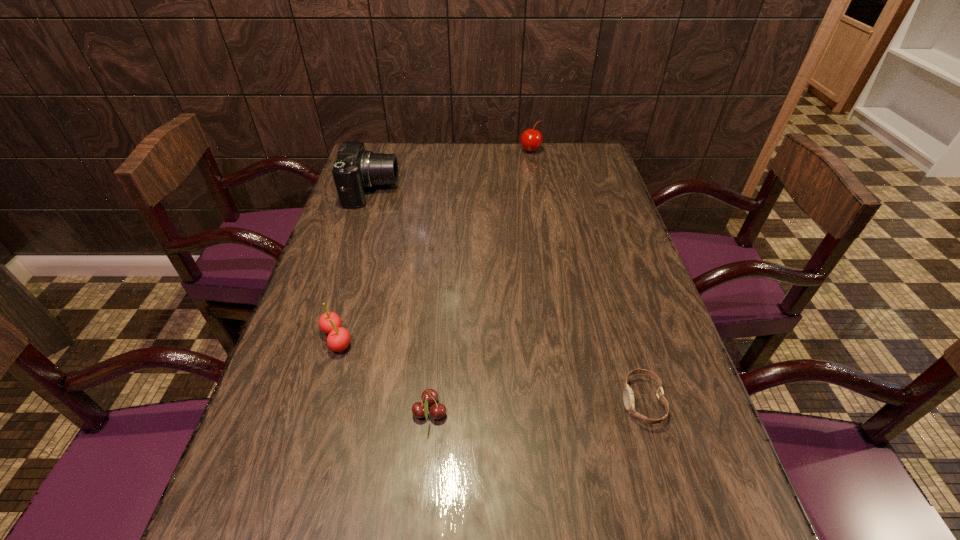
What are the coordinates of `cherry present at the left edge` in the screenshot? It's located at (338, 339).

You are a GUI agent. You are given a task and a screenshot of the screen. Output one action in this format:
    pyautogui.click(x=<x>, y=<y>)
    Task: Click on the object at the right edge
    Image resolution: width=960 pixels, height=540 pixels.
    Given the screenshot: What is the action you would take?
    pyautogui.click(x=628, y=397)

At what (x,y) coordinates should I click in order to perform the action: click on object that is positioned at the far left corner. Please return your answer as a coordinate pair (x, y). Looking at the image, I should click on (355, 169).

Image resolution: width=960 pixels, height=540 pixels. Identify the location of vacant region at the left edge of the desktop. (353, 348).

This screenshot has width=960, height=540. I want to click on vacant space at the right edge, so click(x=656, y=348).

The width and height of the screenshot is (960, 540). Identify the location of free space at the far right corner of the desktop. (588, 173).

Locate an element on the screen. The height and width of the screenshot is (540, 960). unoccupied position between the farthest object and the shortest object is located at coordinates (587, 276).

This screenshot has width=960, height=540. In order to click on free space between the second cherry from left to right and the farthest cherry in this screenshot , I will do `click(480, 281)`.

Locate an element on the screen. This screenshot has height=540, width=960. vacant area that lies between the second farthest object and the leftmost cherry is located at coordinates (354, 265).

Find the location of a particular element. vacant space that is in between the camera and the leftmost cherry is located at coordinates (354, 265).